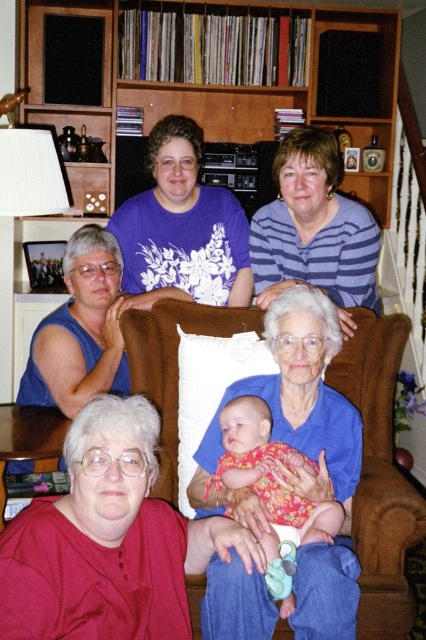
Question: Which point is farther to the camera?

Choices:
 (A) pyautogui.click(x=267, y=632)
 (B) pyautogui.click(x=298, y=269)

Answer: (B)

Question: Observing the image, what is the correct spatial positioning of matte red blouse at lower left in reference to floral fabric baby at center?

Choices:
 (A) above
 (B) below

Answer: (B)

Question: Which of these objects is positioned farthest from the floral fabric baby at center?

Choices:
 (A) blue striped shirt at upper center
 (B) blue fabric at center
 (C) matte red blouse at lower left

Answer: (A)

Question: Among these points, which one is farthest from the camera?

Choices:
 (A) tap(296, 193)
 (B) tap(285, 330)
 (C) tap(89, 624)
 (D) tap(218, 483)

Answer: (A)

Question: Is matte red blouse at lower left below blue striped shirt at upper center?

Choices:
 (A) no
 (B) yes

Answer: (B)

Question: Is matte red blouse at lower left below purple floral shirt at upper center?

Choices:
 (A) yes
 (B) no

Answer: (A)